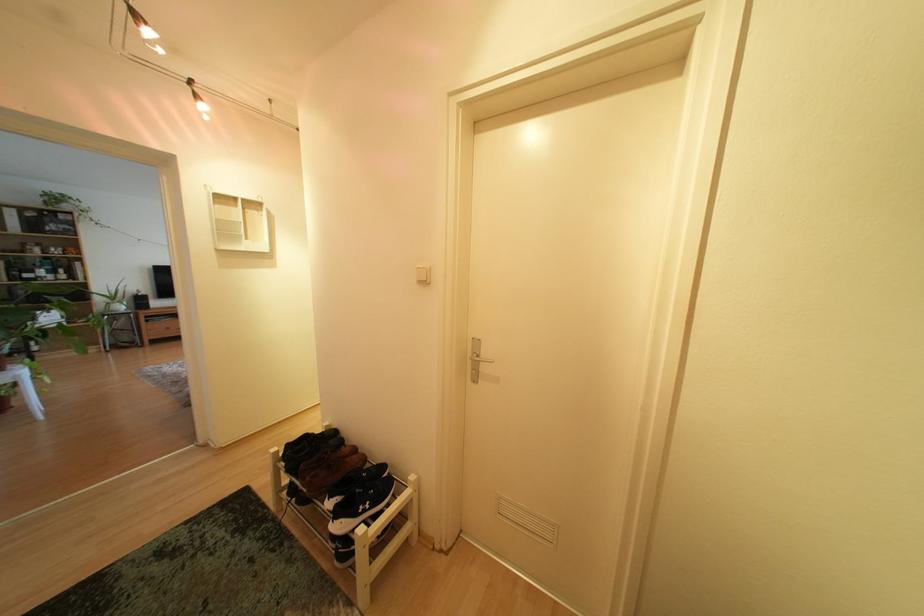
This screenshot has height=616, width=924. Identify the location of white light switch. (422, 274).